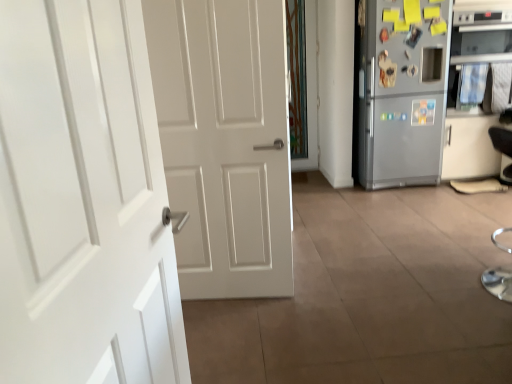
Find the location of a particular element. silver metallic oven at right is located at coordinates (481, 36).

Measure the distance between point (502, 142) and camera.

3.88 meters.

Image resolution: width=512 pixels, height=384 pixels. What are the coordinates of `white glossy door at left` in the screenshot? It's located at (83, 201).

Find the location of a particular element. Image resolution: width=512 pixels, height=384 pixels. silver metallic oven at right is located at coordinates (481, 36).

Between silver metallic oven at right and silver metallic refrigerator at right, which one appears on the right side from the viewer's perspective?

Positioned to the right is silver metallic oven at right.

Is silver metallic oven at right turned away from silver metallic refrigerator at right?

That's not correct — silver metallic oven at right is not looking away from silver metallic refrigerator at right.

From their relative heights in the image, would you say silver metallic oven at right is taller or shorter than silver metallic refrigerator at right?

Clearly, silver metallic oven at right is shorter compared to silver metallic refrigerator at right.

From the image's perspective, is silver metallic oven at right above silver metallic refrigerator at right?

Correct, silver metallic oven at right appears higher than silver metallic refrigerator at right in the image.

What are the coordinates of `armchair located underneath the silver metallic refrigerator at right (from a real-world perspective)` in the screenshot? It's located at (501, 140).

From the image's perspective, which is above, silver metallic refrigerator at right or black leather armchair at right?

From the image's view, silver metallic refrigerator at right is above.

Which object is positioned more to the right, black leather armchair at right or white glossy door at left?

From the viewer's perspective, black leather armchair at right appears more on the right side.

Does black leather armchair at right turn towards white glossy door at left?

No, black leather armchair at right is not facing towards white glossy door at left.

From a real-world perspective, which is physically below, black leather armchair at right or white glossy door at left?

black leather armchair at right is physically lower.

From the image's perspective, which is below, black leather armchair at right or silver metallic oven at right?

black leather armchair at right, from the image's perspective.

Which of these two, black leather armchair at right or silver metallic oven at right, stands taller?

silver metallic oven at right is taller.

Would you say black leather armchair at right is outside silver metallic oven at right?

Yes.

Is the depth of white glossy door at left less than that of silver metallic refrigerator at right?

Yes, white glossy door at left is closer to the viewer.

Is white glossy door at left facing away from silver metallic refrigerator at right?

white glossy door at left is not turned away from silver metallic refrigerator at right.

Can you tell me how much white glossy door at left and silver metallic refrigerator at right differ in facing direction?

The facing directions of white glossy door at left and silver metallic refrigerator at right are 81.3 degrees apart.

Can silver metallic oven at right be found inside white glossy door at left?

No, silver metallic oven at right is not inside white glossy door at left.

Find the location of a particular element. The width and height of the screenshot is (512, 384). door below the silver metallic oven at right (from the image's perspective) is located at coordinates (83, 201).

Which is more to the left, white glossy door at left or silver metallic oven at right?

white glossy door at left.

How different are the orientations of white glossy door at left and silver metallic oven at right in degrees?

white glossy door at left and silver metallic oven at right are facing 81.8 degrees away from each other.

Which of these two, silver metallic refrigerator at right or silver metallic oven at right, stands taller?

silver metallic refrigerator at right is taller.

Is silver metallic refrigerator at right aimed at silver metallic oven at right?

A: No.

Is silver metallic refrigerator at right touching silver metallic oven at right?

No, silver metallic refrigerator at right is not with silver metallic oven at right.

The image size is (512, 384). In order to click on oven on the right of silver metallic refrigerator at right in this screenshot , I will do `click(481, 36)`.

At what (x,y) coordinates should I click in order to perform the action: click on armchair below the silver metallic refrigerator at right (from the image's perspective). Please return your answer as a coordinate pair (x, y). Looking at the image, I should click on (501, 140).

Estimate the real-world distances between objects in this image. Which object is closer to silver metallic refrigerator at right, white glossy door at left or silver metallic oven at right?

Based on the image, silver metallic oven at right appears to be nearer to silver metallic refrigerator at right.

When comparing their distances from silver metallic oven at right, does black leather armchair at right or white glossy door at left seem closer?

black leather armchair at right is closer to silver metallic oven at right.

Considering their positions, is silver metallic oven at right positioned further to black leather armchair at right than white glossy door at left?

The object further to black leather armchair at right is white glossy door at left.

Looking at the image, which one is located further to white glossy door at left, silver metallic refrigerator at right or silver metallic oven at right?

silver metallic oven at right is positioned further to the anchor white glossy door at left.

Estimate the real-world distances between objects in this image. Which object is further from white glossy door at left, silver metallic oven at right or silver metallic refrigerator at right?

silver metallic oven at right.

Which object lies nearer to the anchor point silver metallic refrigerator at right, black leather armchair at right or white glossy door at left?

Based on the image, black leather armchair at right appears to be nearer to silver metallic refrigerator at right.

Considering their positions, is white glossy door at left positioned closer to silver metallic oven at right than silver metallic refrigerator at right?

The object closer to silver metallic oven at right is silver metallic refrigerator at right.

From the image, which object appears to be farther from silver metallic refrigerator at right, silver metallic oven at right or black leather armchair at right?

black leather armchair at right is further to silver metallic refrigerator at right.

This screenshot has height=384, width=512. I want to click on refrigerator between white glossy door at left and silver metallic oven at right along the z-axis, so click(403, 92).

Locate an element on the screen. armchair between white glossy door at left and silver metallic oven at right in the front-back direction is located at coordinates (501, 140).

Where is `refrigerator between white glossy door at left and black leather armchair at right along the z-axis`? The width and height of the screenshot is (512, 384). refrigerator between white glossy door at left and black leather armchair at right along the z-axis is located at coordinates (403, 92).

The image size is (512, 384). In order to click on oven between silver metallic refrigerator at right and black leather armchair at right in this screenshot , I will do `click(481, 36)`.